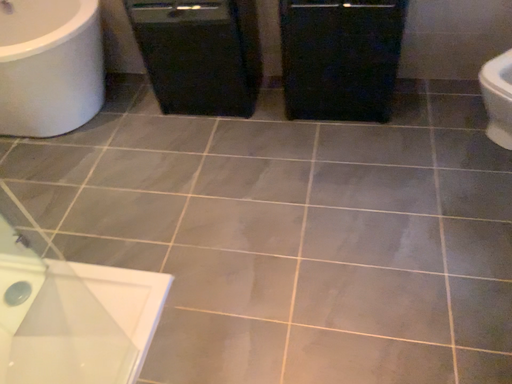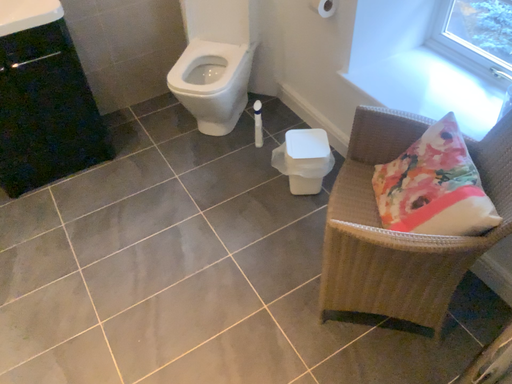
Question: Which way did the camera rotate in the video?

Choices:
 (A) rotated downward
 (B) rotated upward

Answer: (B)